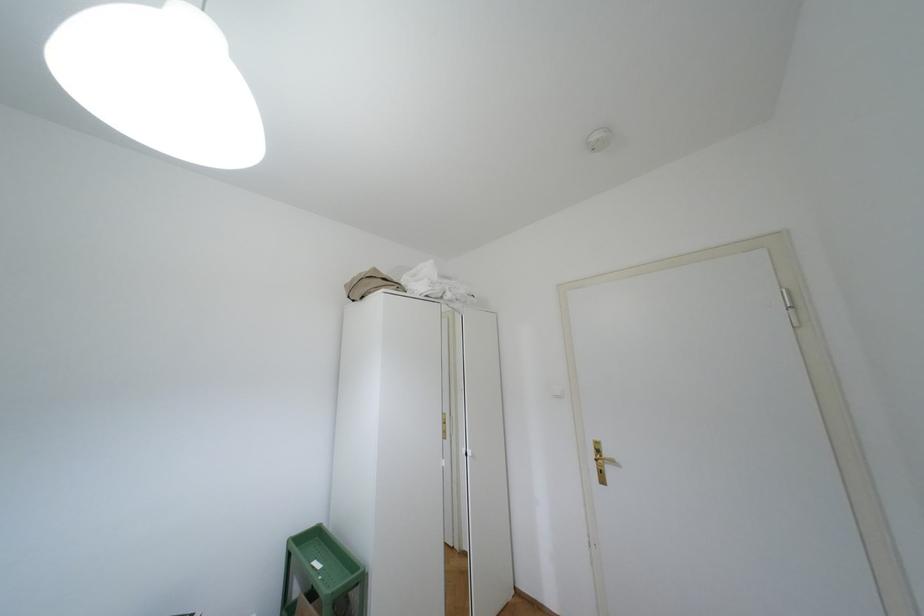
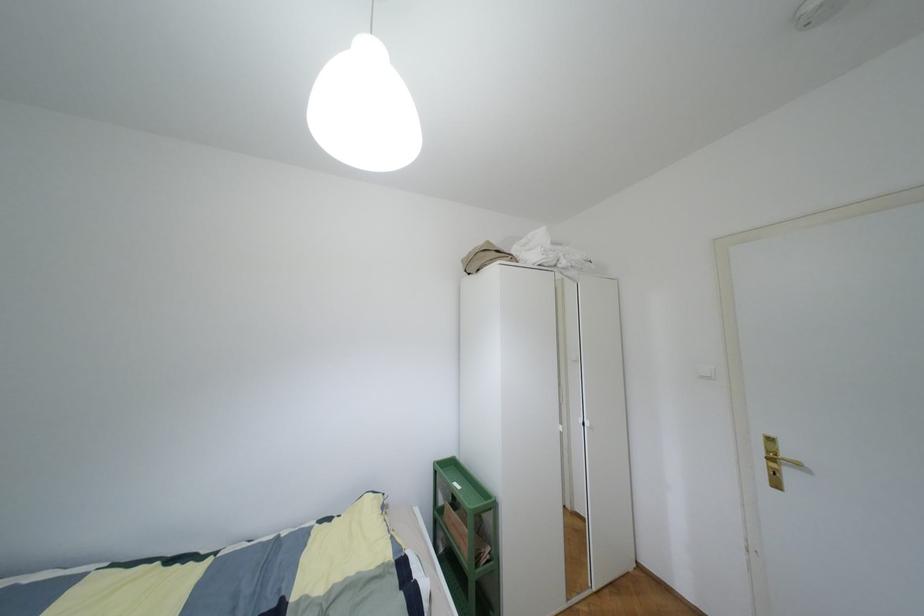
Which direction would the cameraman need to move to produce the second image?

The cameraman walked toward left, backward.